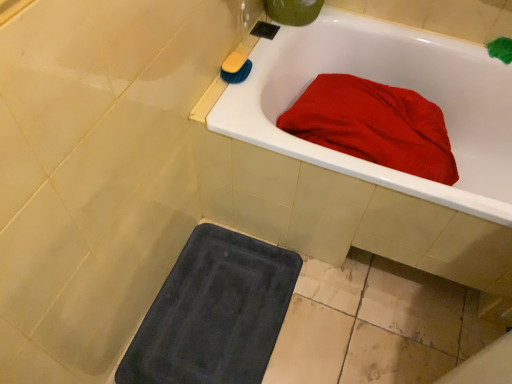
Describe the element at coordinates (234, 63) in the screenshot. Image resolution: width=512 pixels, height=384 pixels. I see `yellow sponge at upper left` at that location.

Identify the location of yellow sponge at upper left. The image size is (512, 384). (234, 63).

Describe the element at coordinates (388, 84) in the screenshot. I see `matte white bathtub at upper right` at that location.

At what (x,y) coordinates should I click in order to perform the action: click on matte white bathtub at upper right. Please return your answer as a coordinate pair (x, y). Image resolution: width=512 pixels, height=384 pixels. Looking at the image, I should click on (388, 84).

Find the location of a particular element. yellow sponge at upper left is located at coordinates (234, 63).

Between matte white bathtub at upper right and yellow sponge at upper left, which one appears on the left side from the viewer's perspective?

Positioned to the left is yellow sponge at upper left.

Does matte white bathtub at upper right lie behind yellow sponge at upper left?

No.

Which point is more forward, [244,91] or [238,54]?

The point [244,91] is closer to the camera.

From the image's perspective, is matte white bathtub at upper right under yellow sponge at upper left?

Yes, from the image's perspective, matte white bathtub at upper right is beneath yellow sponge at upper left.

From a real-world perspective, relative to yellow sponge at upper left, is matte white bathtub at upper right vertically above or below?

In terms of real-world spatial position, matte white bathtub at upper right is below yellow sponge at upper left.

Which object is wider, matte white bathtub at upper right or yellow sponge at upper left?

Wider between the two is matte white bathtub at upper right.

Does matte white bathtub at upper right have a lesser height compared to yellow sponge at upper left?

No, matte white bathtub at upper right is not shorter than yellow sponge at upper left.

Considering the relative sizes of matte white bathtub at upper right and yellow sponge at upper left in the image provided, is matte white bathtub at upper right smaller than yellow sponge at upper left?

Incorrect, matte white bathtub at upper right is not smaller in size than yellow sponge at upper left.

Is matte white bathtub at upper right spatially inside yellow sponge at upper left, or outside of it?

The correct answer is: outside.

Is the surface of matte white bathtub at upper right in direct contact with yellow sponge at upper left?

No, matte white bathtub at upper right is not with yellow sponge at upper left.

Is matte white bathtub at upper right looking in the opposite direction of yellow sponge at upper left?

matte white bathtub at upper right is not turned away from yellow sponge at upper left.

How many degrees apart are the facing directions of matte white bathtub at upper right and yellow sponge at upper left?

The angular difference between matte white bathtub at upper right and yellow sponge at upper left is 90.5 degrees.

Where is `bathtub lying below the yellow sponge at upper left (from the image's perspective)`? bathtub lying below the yellow sponge at upper left (from the image's perspective) is located at coordinates (388, 84).

Which is more to the left, yellow sponge at upper left or matte white bathtub at upper right?

Positioned to the left is yellow sponge at upper left.

In the image, is yellow sponge at upper left positioned in front of or behind matte white bathtub at upper right?

Visually, yellow sponge at upper left is located behind matte white bathtub at upper right.

Is point (234, 60) more distant than point (284, 132)?

Yes, it is behind point (284, 132).

From the image's perspective, is yellow sponge at upper left above or below matte white bathtub at upper right?

Based on their image positions, yellow sponge at upper left is located above matte white bathtub at upper right.

From a real-world perspective, does yellow sponge at upper left sit lower than matte white bathtub at upper right?

No, from a real-world perspective, yellow sponge at upper left is not beneath matte white bathtub at upper right.

Considering the relative sizes of yellow sponge at upper left and matte white bathtub at upper right in the image provided, is yellow sponge at upper left wider than matte white bathtub at upper right?

No, yellow sponge at upper left is not wider than matte white bathtub at upper right.

From their relative heights in the image, would you say yellow sponge at upper left is taller or shorter than matte white bathtub at upper right?

yellow sponge at upper left is shorter than matte white bathtub at upper right.

Considering the relative sizes of yellow sponge at upper left and matte white bathtub at upper right in the image provided, is yellow sponge at upper left smaller than matte white bathtub at upper right?

Indeed, yellow sponge at upper left has a smaller size compared to matte white bathtub at upper right.

Would you say yellow sponge at upper left is outside matte white bathtub at upper right?

Actually, yellow sponge at upper left is within matte white bathtub at upper right.

Is yellow sponge at upper left placed right next to matte white bathtub at upper right?

No, yellow sponge at upper left is not in contact with matte white bathtub at upper right.

Could you tell me if yellow sponge at upper left is facing matte white bathtub at upper right?

No, yellow sponge at upper left does not turn towards matte white bathtub at upper right.

Can you tell me how much yellow sponge at upper left and matte white bathtub at upper right differ in facing direction?

90.5 degrees separate the facing orientations of yellow sponge at upper left and matte white bathtub at upper right.

The width and height of the screenshot is (512, 384). In order to click on bathtub below the yellow sponge at upper left (from the image's perspective) in this screenshot , I will do `click(388, 84)`.

Find the location of a particular element. The image size is (512, 384). soap behind the matte white bathtub at upper right is located at coordinates (234, 63).

Identify the location of soap lying on the left of matte white bathtub at upper right. This screenshot has height=384, width=512. (234, 63).